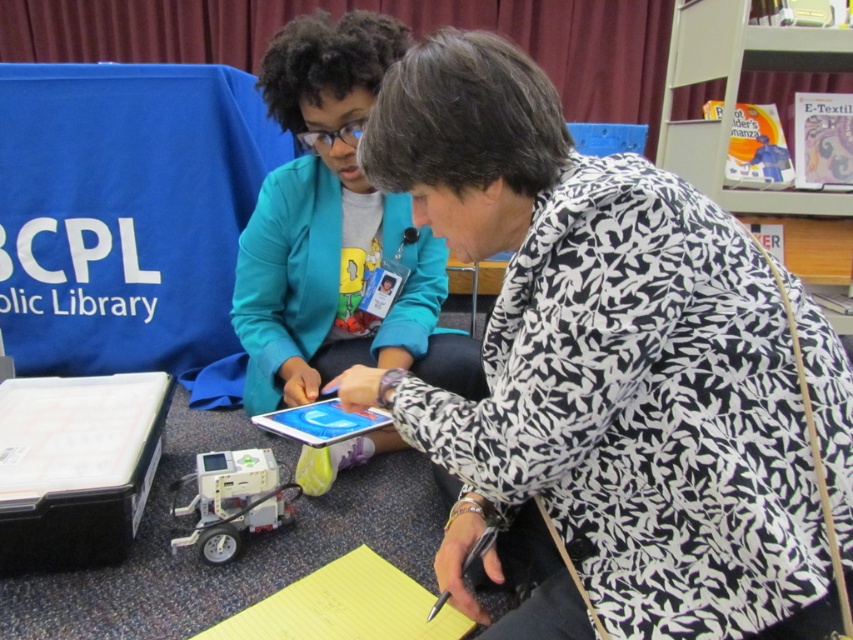
Where is `black printed shirt at center`? black printed shirt at center is located at coordinates (613, 372).

Find the location of `black printed shirt at center`. black printed shirt at center is located at coordinates (613, 372).

Does point (729, 490) come in front of point (216, 518)?

Yes, it is in front of point (216, 518).

Can you confirm if black printed shirt at center is smaller than metallic plastic robot at lower left?

No.

Between point (646, 532) and point (259, 493), which one is positioned in front?

Point (646, 532) is in front.

You are a GUI agent. You are given a task and a screenshot of the screen. Output one action in this format:
    pyautogui.click(x=<x>, y=<y>)
    Task: Click on the black printed shirt at center
    The image size is (853, 640).
    Given the screenshot: What is the action you would take?
    pyautogui.click(x=613, y=372)

Find the location of `teal fabric jacket at center`. teal fabric jacket at center is located at coordinates [x=335, y=230].

Which of these two, teal fabric jacket at center or metallic plastic robot at lower left, stands shorter?

metallic plastic robot at lower left is shorter.

Is point (320, 136) in front of point (270, 449)?

Yes, it is.

I want to click on teal fabric jacket at center, so click(335, 230).